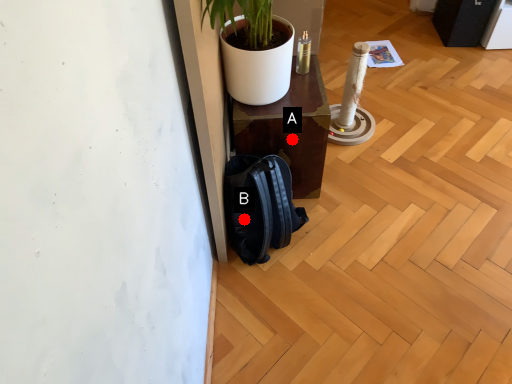
Question: Two points are circled on the image, labeled by A and B beside each circle. Which point is closer to the camera?

Choices:
 (A) A is closer
 (B) B is closer

Answer: (B)